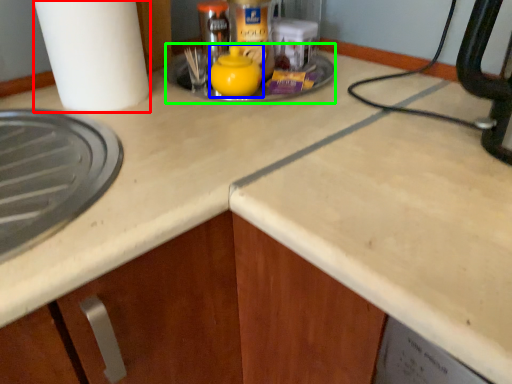
Question: Which is farther away from paper towel (highlighted by a red box)? tea pot (highlighted by a blue box) or sink (highlighted by a green box)?

Choices:
 (A) tea pot
 (B) sink

Answer: (A)